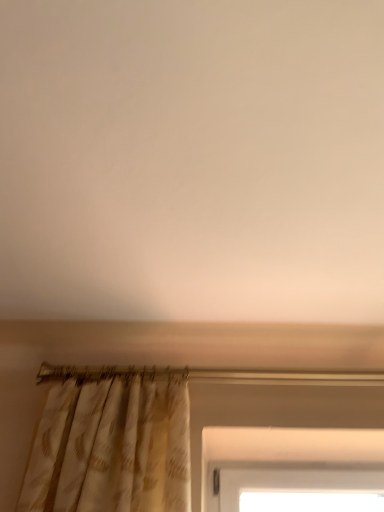
The height and width of the screenshot is (512, 384). What are the coordinates of `gold metallic curtain rod at center` in the screenshot? It's located at (211, 375).

Image resolution: width=384 pixels, height=512 pixels. What do you see at coordinates (211, 375) in the screenshot? I see `gold metallic curtain rod at center` at bounding box center [211, 375].

The width and height of the screenshot is (384, 512). What are the coordinates of `gold metallic curtain rod at center` in the screenshot? It's located at (211, 375).